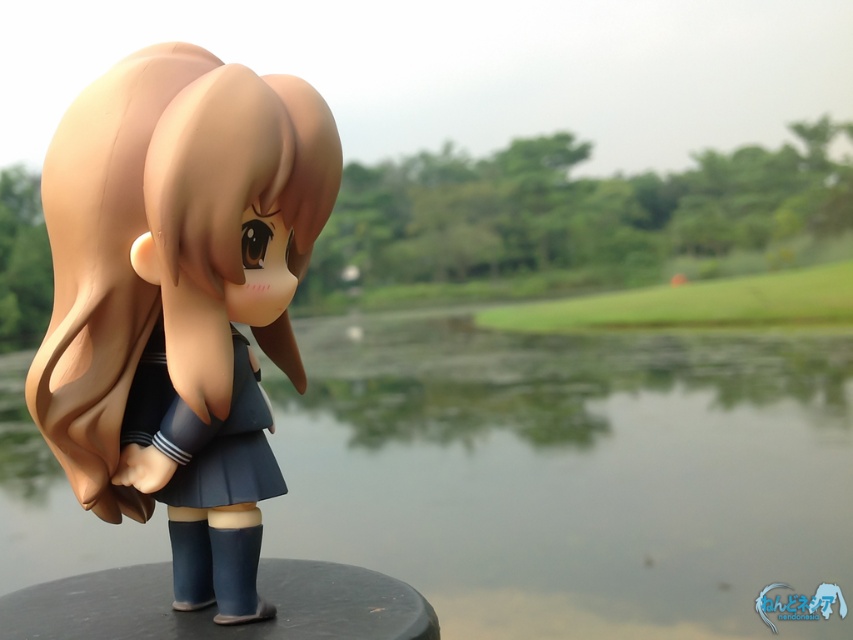
Does transparent water at center appear on the left side of satin brown hair at center?

Incorrect, transparent water at center is not on the left side of satin brown hair at center.

Is transparent water at center positioned before satin brown hair at center?

That is False.

Is point (851, 356) positioned behind point (239, 568)?

Yes, it is.

Find the location of a particular element. This screenshot has width=853, height=640. transparent water at center is located at coordinates (572, 472).

Between transparent water at center and green grass at center, which one is positioned higher?

green grass at center

Can you confirm if transparent water at center is positioned below green grass at center?

Yes.

Is point (782, 532) closer to viewer compared to point (584, 310)?

That is True.

The width and height of the screenshot is (853, 640). What are the coordinates of `transparent water at center` in the screenshot? It's located at (572, 472).

Which is more to the right, transparent water at center or satin blue skirt at center?

From the viewer's perspective, transparent water at center appears more on the right side.

I want to click on transparent water at center, so click(572, 472).